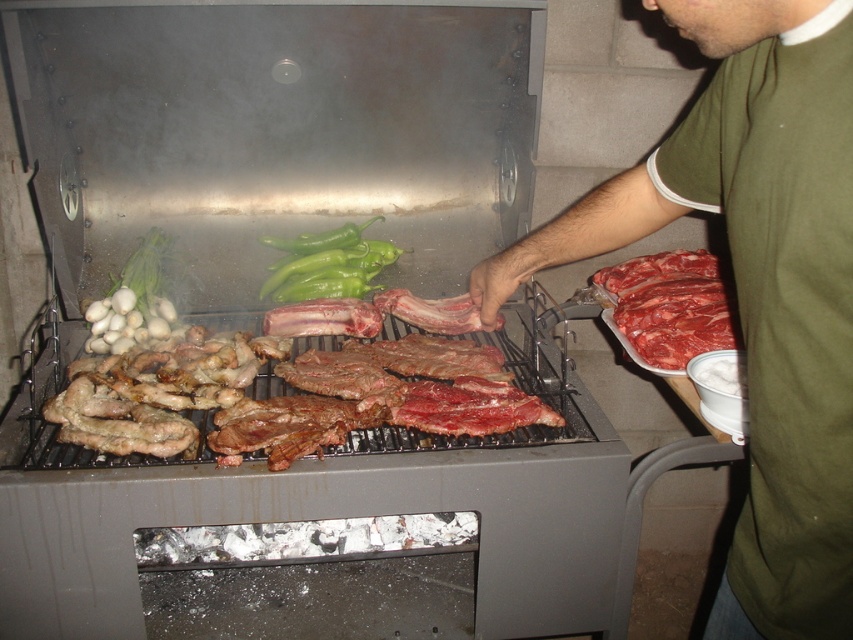
You are standing in front of the grill and notice two points marked on the grill surface. The first point is at coordinate point (x=436, y=106) and the second is at point (x=155, y=246). Which point is closer to you?

Point (x=155, y=246) is closer to you because it is less further to the camera than point (x=436, y=106).

You are trying to decide whether to hang a decorative metal hook on the wall next to the green cotton shirt at upper right or the green glossy peppers at center. Which object would require a stronger hook due to its thickness?

The green glossy peppers at center require a stronger hook because they are thicker than the green cotton shirt at upper right.

You are a guest at a barbecue and want to grab the green matte onion at upper left from the grill. However, the raw red meat at right is blocking your access. Based on the scene, can you reach the onion without moving the meat?

The raw red meat at right is in front of the green matte onion at upper left, so you cannot reach the onion without moving the meat.